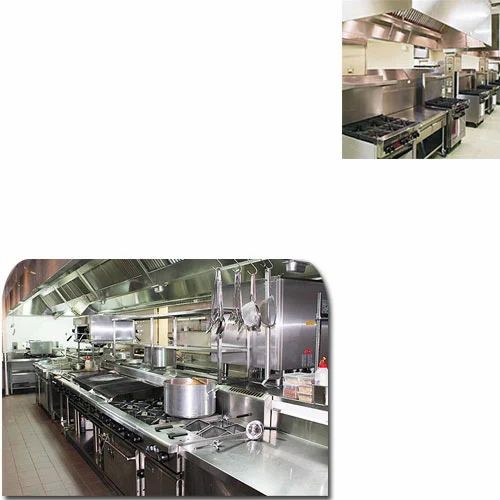
I want to click on shelves, so click(x=182, y=312), click(x=193, y=353), click(x=447, y=77).